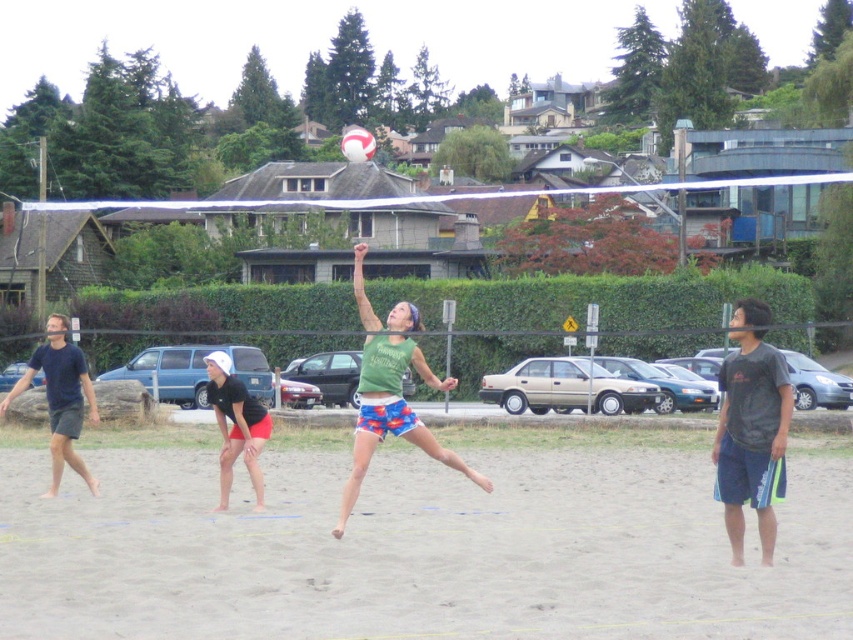
You are standing at the point labeled as point (x=26, y=381) on the volleyball court. If you want to throw a ball to a friend who is standing 15 meters away from you, can you reach them by throwing the ball straight ahead? Explain your reasoning based on the scene description.

The point labeled as point (x=26, y=381) and the viewer are 15.60 meters apart. Since your friend is 15 meters away, which is within the 15.60 meters distance, you can reach them by throwing the ball straight ahead.

You are a photographer standing at the edge of the beach volleyball court. You want to capture a photo of the matte black shorts at lower left and the white matte volleyball at center in the same frame. Given their distance apart, will you need to adjust your camera lens to a wider angle to ensure both objects are fully visible?

The matte black shorts at lower left and the white matte volleyball at center are 231.53 feet apart. To capture both in the same frame, you would need to use a wider angle lens to accommodate the distance between them.